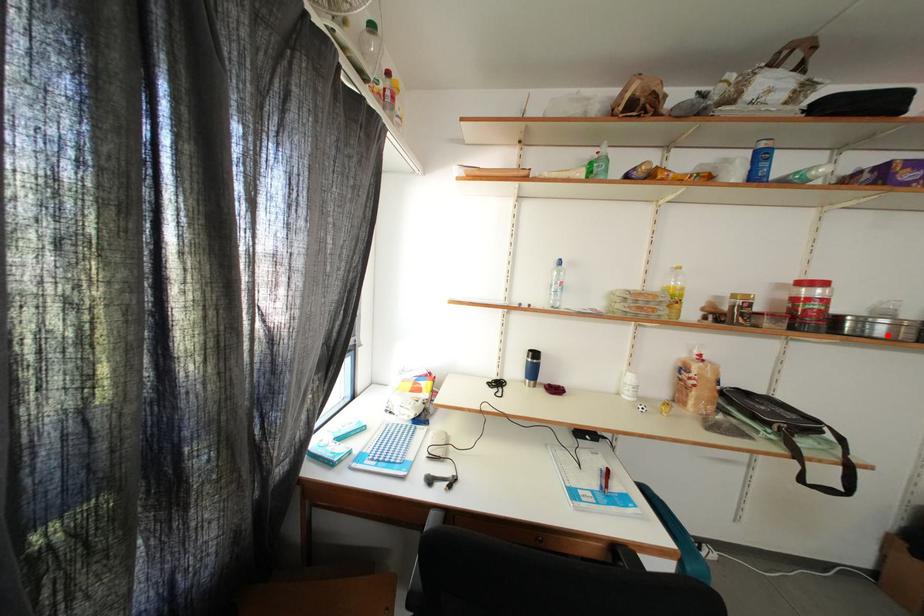
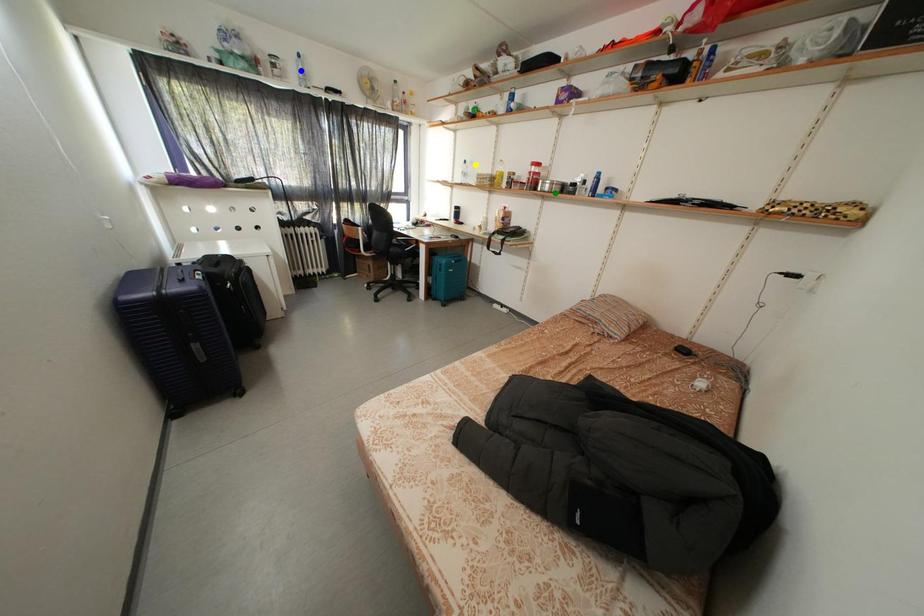
Question: I am providing you with two images of the same scene from different viewpoints. A red point is marked on the first image. You are given multiple points on the second image. Which point in image 2 is actually the same real-world point as the red point in image 1?

Choices:
 (A) blue point
 (B) yellow point
 (C) green point

Answer: (C)